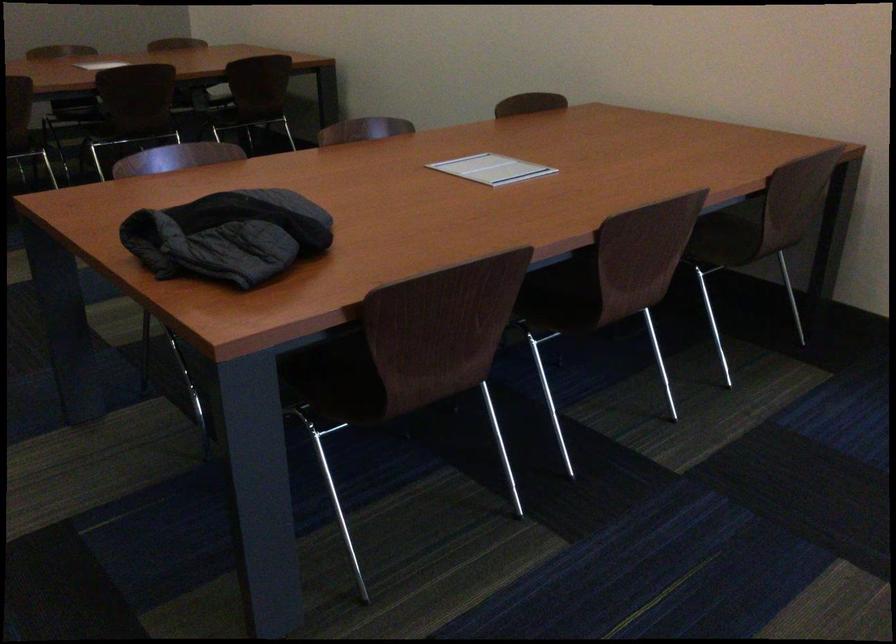
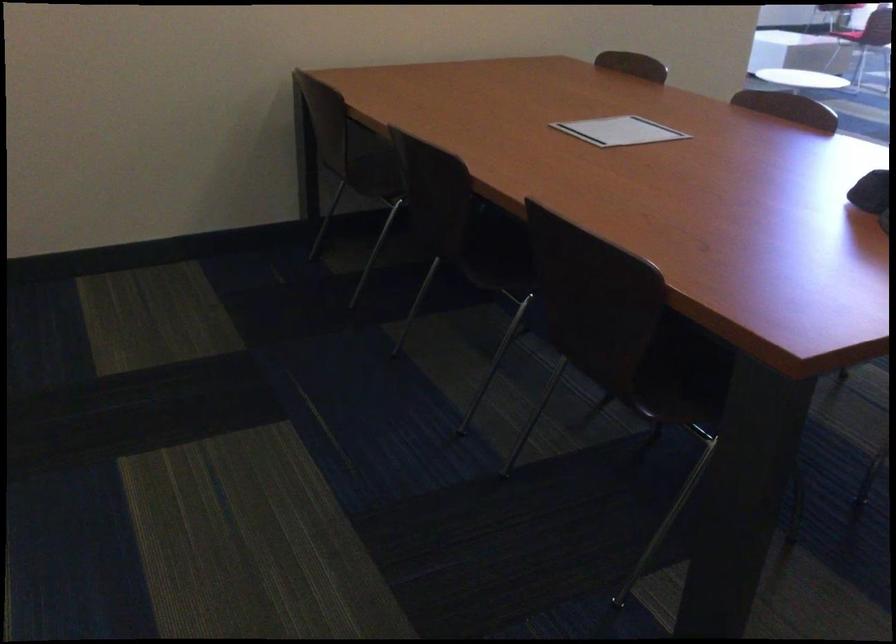
Question: I am providing you with two images of the same scene from different viewpoints. Which of the following objects are not visible in image2?

Choices:
 (A) white paper document
 (B) urn lid handle
 (C) brown chair sitting surface
 (D) chair sitting surface

Answer: (D)